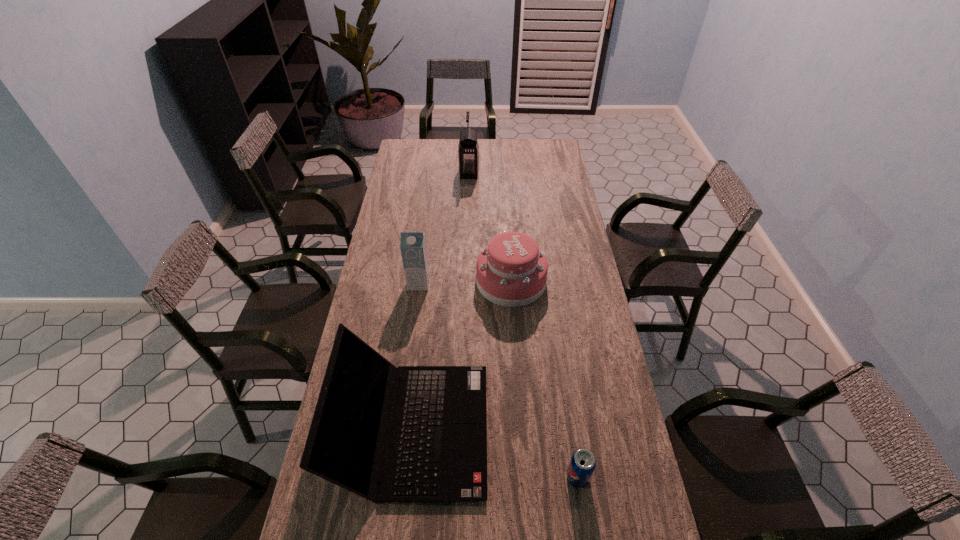
Locate an element on the screen. This screenshot has width=960, height=540. free space that satisfies the following two spatial constraints: 1. on the front-facing side of the lantern; 2. on the front label of the carton is located at coordinates (466, 283).

At what (x,y) coordinates should I click in order to perform the action: click on free space that satisfies the following two spatial constraints: 1. on the screen of the laptop computer; 2. on the left side of the pop soda. Please return your answer as a coordinate pair (x, y). Looking at the image, I should click on pyautogui.click(x=409, y=477).

At what (x,y) coordinates should I click in order to perform the action: click on free space that satisfies the following two spatial constraints: 1. on the back side of the second shortest object; 2. on the front-facing side of the lantern. Please return your answer as a coordinate pair (x, y). The height and width of the screenshot is (540, 960). Looking at the image, I should click on (504, 173).

The image size is (960, 540). What are the coordinates of `free region that satisfies the following two spatial constraints: 1. on the front label of the pop soda; 2. on the right side of the carton` in the screenshot? It's located at (393, 477).

Locate an element on the screen. vacant region that satisfies the following two spatial constraints: 1. on the front side of the shortest object; 2. on the right side of the cake is located at coordinates (524, 477).

Where is `free location that satisfies the following two spatial constraints: 1. on the front-facing side of the cake; 2. on the right side of the farthest object`? The image size is (960, 540). free location that satisfies the following two spatial constraints: 1. on the front-facing side of the cake; 2. on the right side of the farthest object is located at coordinates (466, 281).

Where is `vacant space that satisfies the following two spatial constraints: 1. on the front-facing side of the lantern; 2. on the back side of the second shortest object`? vacant space that satisfies the following two spatial constraints: 1. on the front-facing side of the lantern; 2. on the back side of the second shortest object is located at coordinates (466, 281).

This screenshot has height=540, width=960. Find the location of `vacant space that satisfies the following two spatial constraints: 1. on the screen of the laptop computer; 2. on the right side of the pop soda`. vacant space that satisfies the following two spatial constraints: 1. on the screen of the laptop computer; 2. on the right side of the pop soda is located at coordinates (409, 477).

Image resolution: width=960 pixels, height=540 pixels. I want to click on free spot that satisfies the following two spatial constraints: 1. on the screen of the laptop computer; 2. on the left side of the pop soda, so click(409, 477).

You are a GUI agent. You are given a task and a screenshot of the screen. Output one action in this format:
    pyautogui.click(x=<x>, y=<y>)
    Task: Click on the vacant space that satisfies the following two spatial constraints: 1. on the back side of the cake; 2. on the front-facing side of the tallest object
    
    Given the screenshot: What is the action you would take?
    point(504,173)